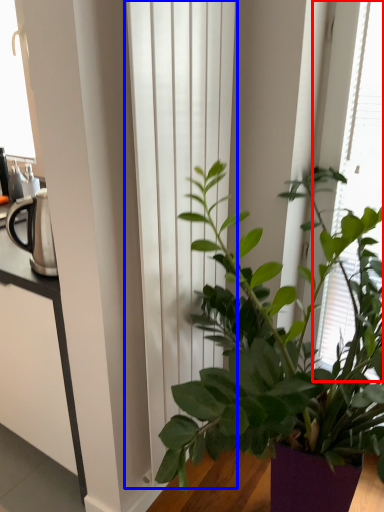
Question: Among these objects, which one is farthest to the camera, bay window (highlighted by a red box) or curtain (highlighted by a blue box)?

Choices:
 (A) bay window
 (B) curtain

Answer: (A)